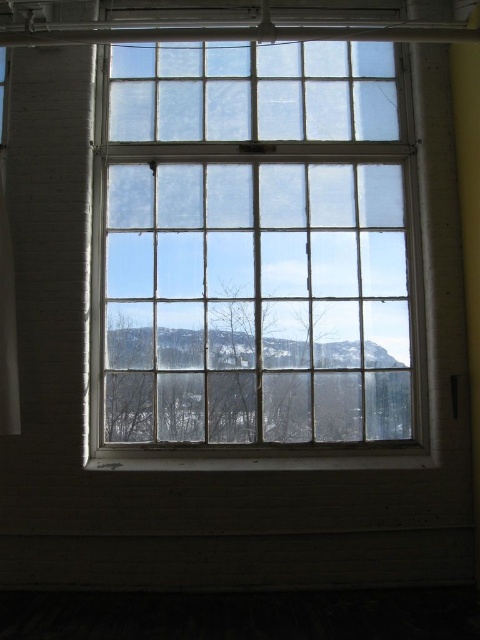
Question: Which object appears closest to the camera in this image?

Choices:
 (A) white sheer curtain at left
 (B) clear glass window at center

Answer: (A)

Question: Is clear glass window at center thinner than white sheer curtain at left?

Choices:
 (A) yes
 (B) no

Answer: (B)

Question: Is clear glass window at center wider than white sheer curtain at left?

Choices:
 (A) no
 (B) yes

Answer: (B)

Question: Which object appears farthest from the camera in this image?

Choices:
 (A) clear glass window at center
 (B) white sheer curtain at left

Answer: (A)

Question: Does clear glass window at center have a smaller size compared to white sheer curtain at left?

Choices:
 (A) no
 (B) yes

Answer: (A)